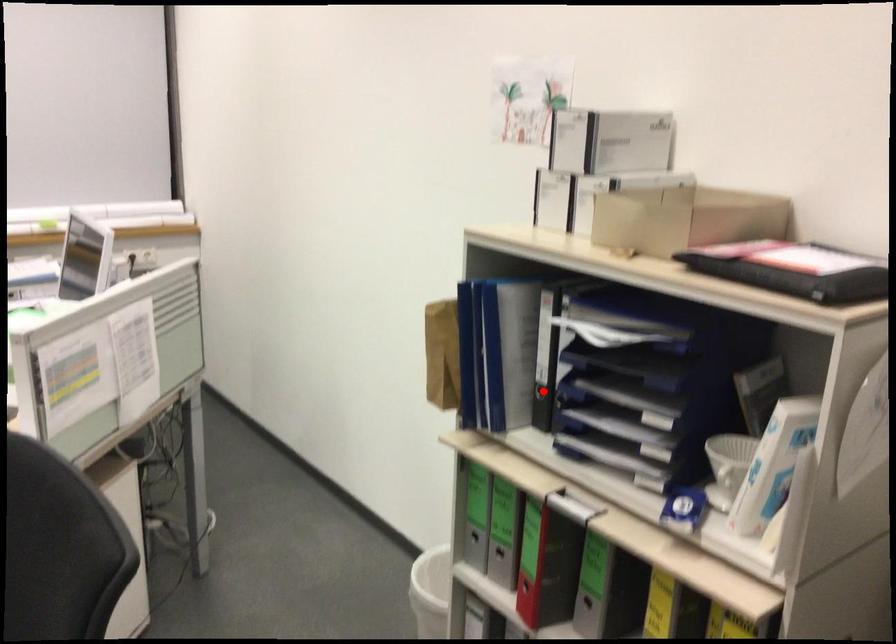
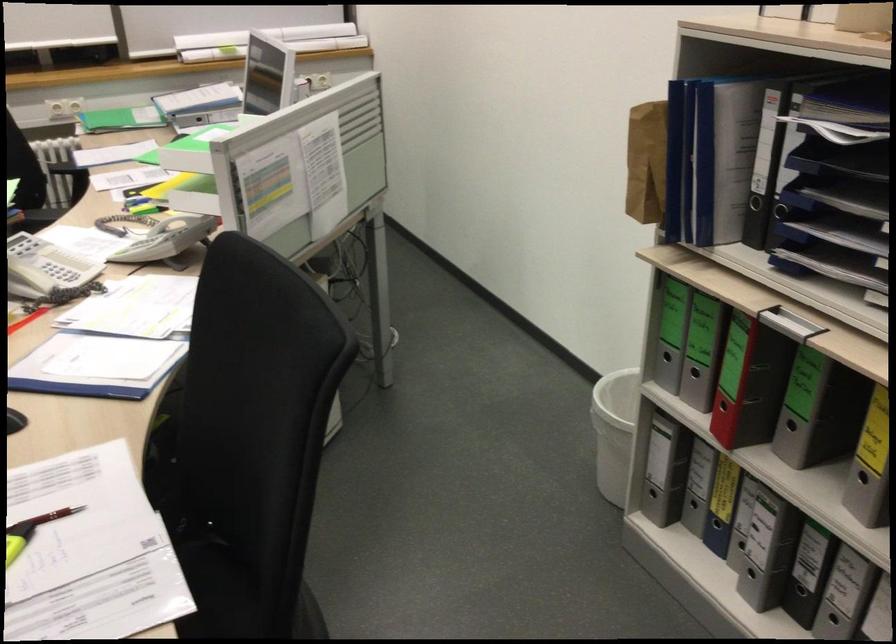
The point at the highlighted location is marked in the first image. Where is the corresponding point in the second image?

(754, 203)